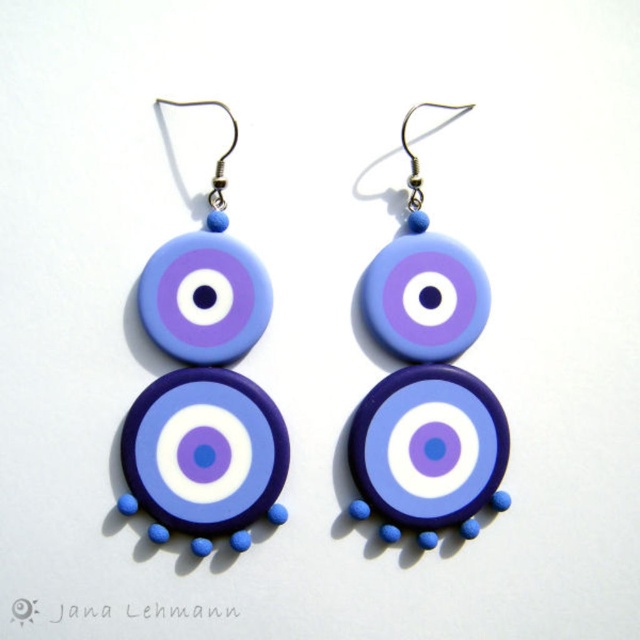
Question: Which point is closer to the camera?

Choices:
 (A) matte clay eye at center
 (B) matte clay earring at center

Answer: (A)

Question: Can you confirm if matte clay eye at center is positioned to the right of matte clay earring at center?

Choices:
 (A) no
 (B) yes

Answer: (A)

Question: Which of the following is the closest to the observer?

Choices:
 (A) (189, 513)
 (B) (502, 464)

Answer: (A)

Question: Can you confirm if matte clay eye at center is positioned above matte clay earring at center?

Choices:
 (A) yes
 (B) no

Answer: (B)

Question: Which point appears closest to the camera in this image?

Choices:
 (A) (410, 244)
 (B) (200, 292)

Answer: (B)

Question: Does matte clay eye at center appear over matte clay earring at center?

Choices:
 (A) yes
 (B) no

Answer: (B)